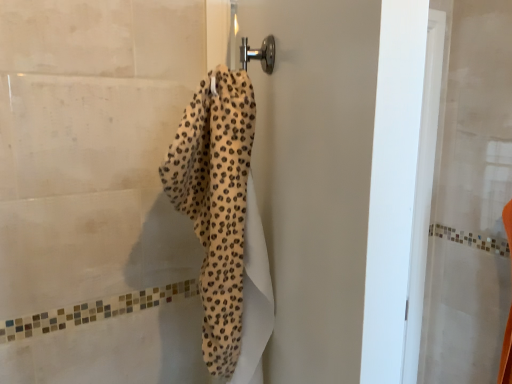
Question: Should I look upward or downward to see cheetah print towel at center?

Choices:
 (A) up
 (B) down

Answer: (B)

Question: Is leopard print towel at center in front of cheetah print towel at center?

Choices:
 (A) no
 (B) yes

Answer: (A)

Question: From the image's perspective, is leopard print towel at center below cheetah print towel at center?

Choices:
 (A) no
 (B) yes

Answer: (B)

Question: Can you confirm if leopard print towel at center is bigger than cheetah print towel at center?

Choices:
 (A) no
 (B) yes

Answer: (B)

Question: Are leopard print towel at center and cheetah print towel at center making contact?

Choices:
 (A) no
 (B) yes

Answer: (A)

Question: From the image's perspective, is leopard print towel at center located above cheetah print towel at center?

Choices:
 (A) no
 (B) yes

Answer: (A)

Question: From a real-world perspective, is leopard print towel at center on cheetah print towel at center?

Choices:
 (A) yes
 (B) no

Answer: (B)

Question: Is cheetah print towel at center oriented away from leopard print towel at center?

Choices:
 (A) no
 (B) yes

Answer: (A)

Question: From the image's perspective, is cheetah print towel at center over leopard print towel at center?

Choices:
 (A) yes
 (B) no

Answer: (A)

Question: Considering the relative sizes of cheetah print towel at center and leopard print towel at center in the image provided, is cheetah print towel at center wider than leopard print towel at center?

Choices:
 (A) no
 (B) yes

Answer: (B)

Question: Is the position of cheetah print towel at center less distant than that of leopard print towel at center?

Choices:
 (A) no
 (B) yes

Answer: (B)

Question: From the image's perspective, does cheetah print towel at center appear lower than leopard print towel at center?

Choices:
 (A) yes
 (B) no

Answer: (B)

Question: Is the depth of cheetah print towel at center greater than that of leopard print towel at center?

Choices:
 (A) yes
 (B) no

Answer: (B)

Question: Is cheetah print towel at center in front of or behind leopard print towel at center in the image?

Choices:
 (A) behind
 (B) front

Answer: (B)